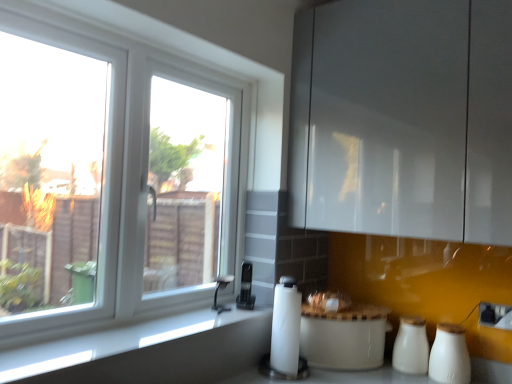
Where is `free space in front of black plastic phone at center, the second appliance from the right`? free space in front of black plastic phone at center, the second appliance from the right is located at coordinates point(231,313).